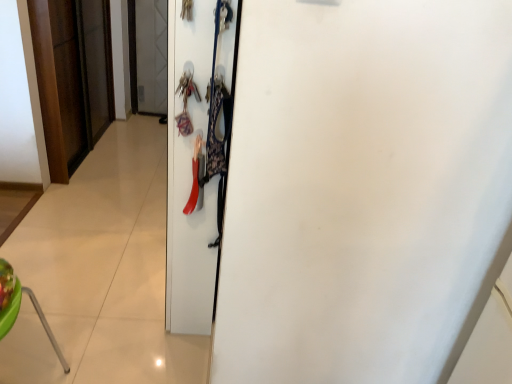
Question: From the image's perspective, is white matte door at center, which ranks as the second door in back-to-front order, located above or below wooden door at left, which ranks as the second door in front-to-back order?

Choices:
 (A) above
 (B) below

Answer: (B)

Question: Considering the positions of white matte door at center, which is counted as the second door, starting from the left, and wooden door at left, the 2th door positioned from the right, in the image, is white matte door at center, which is counted as the second door, starting from the left, taller or shorter than wooden door at left, the 2th door positioned from the right,?

Choices:
 (A) tall
 (B) short

Answer: (A)

Question: Does point (169, 52) appear closer or farther from the camera than point (62, 39)?

Choices:
 (A) farther
 (B) closer

Answer: (B)

Question: From the image's perspective, is wooden door at left, which ranks as the second door in front-to-back order, above or below white matte door at center, which is counted as the second door, starting from the left?

Choices:
 (A) below
 (B) above

Answer: (B)

Question: In terms of height, does wooden door at left, which ranks as the second door in front-to-back order, look taller or shorter compared to white matte door at center, the 1th door viewed from the front?

Choices:
 (A) short
 (B) tall

Answer: (A)

Question: Considering the positions of wooden door at left, which ranks as the second door in front-to-back order, and white matte door at center, which is the first door in right-to-left order, in the image, is wooden door at left, which ranks as the second door in front-to-back order, bigger or smaller than white matte door at center, which is the first door in right-to-left order,?

Choices:
 (A) small
 (B) big

Answer: (A)

Question: Considering the relative positions of wooden door at left, which is the 1th door in back-to-front order, and white matte door at center, which is counted as the second door, starting from the left, in the image provided, is wooden door at left, which is the 1th door in back-to-front order, to the left or to the right of white matte door at center, which is counted as the second door, starting from the left,?

Choices:
 (A) left
 (B) right

Answer: (A)